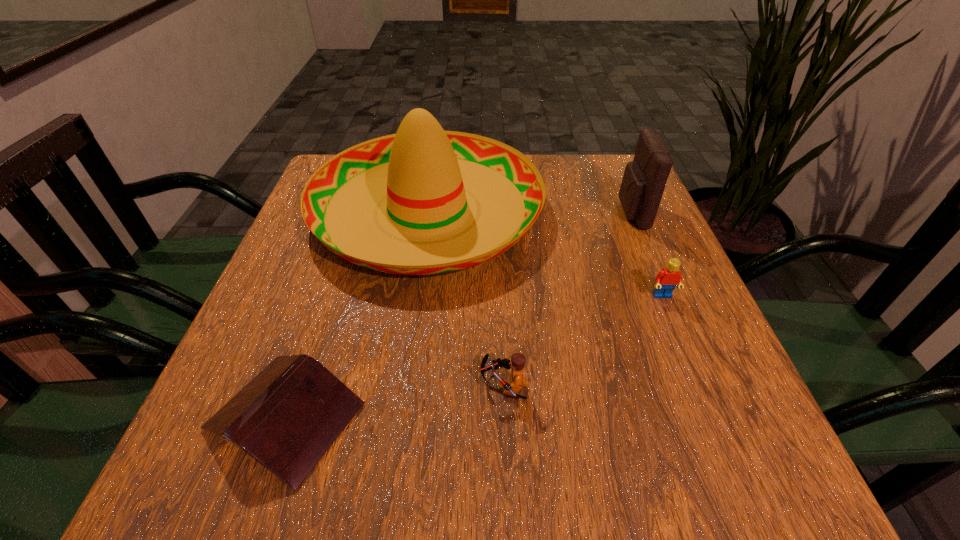
The width and height of the screenshot is (960, 540). I want to click on free space located 0.090m holding a crossbow in the hands of the left Lego, so click(423, 385).

Locate an element on the screen. blank space located holding a crossbow in the hands of the left Lego is located at coordinates (443, 385).

Where is `free location located 0.130m holding a crossbow in the hands of the left Lego`? The height and width of the screenshot is (540, 960). free location located 0.130m holding a crossbow in the hands of the left Lego is located at coordinates (398, 385).

This screenshot has width=960, height=540. I want to click on vacant region located 0.280m on the right of the book, so click(x=548, y=417).

What are the coordinates of `sombrero that is at the far edge` in the screenshot? It's located at (422, 172).

Where is `pouch present at the far edge`? pouch present at the far edge is located at coordinates (644, 180).

Locate an element on the screen. The image size is (960, 540). object located in the near edge section of the desktop is located at coordinates (287, 417).

Locate an element on the screen. The height and width of the screenshot is (540, 960). sombrero present at the left edge is located at coordinates (422, 172).

Locate an element on the screen. The image size is (960, 540). book that is at the left edge is located at coordinates (287, 417).

You are a GUI agent. You are given a task and a screenshot of the screen. Output one action in this format:
    pyautogui.click(x=<x>, y=<y>)
    Task: Click on the pouch at the right edge
    
    Given the screenshot: What is the action you would take?
    pyautogui.click(x=644, y=180)